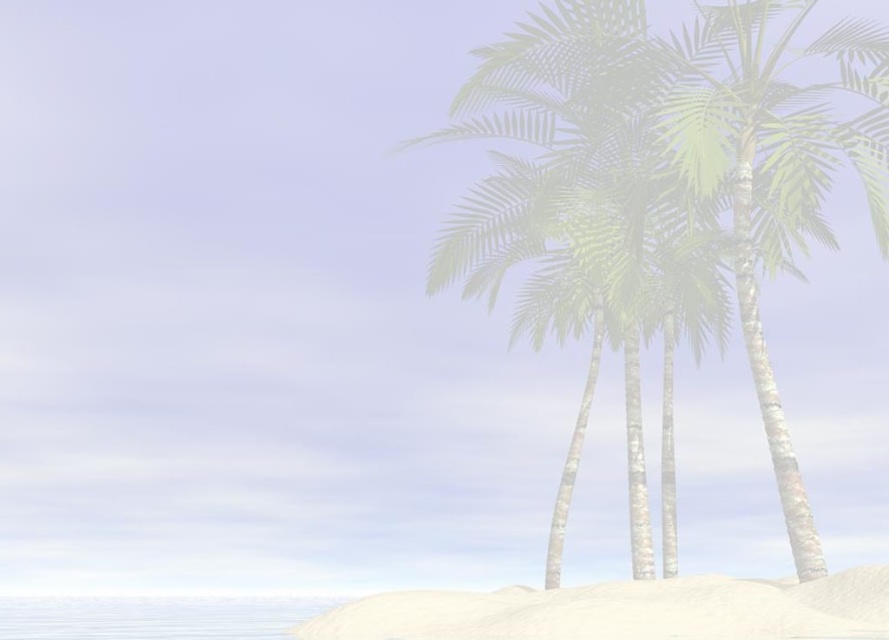
Between green leafy palm tree at right and white sandy beach at lower center, which one has less height?

With less height is green leafy palm tree at right.

Does green leafy palm tree at right appear under white sandy beach at lower center?

Incorrect, green leafy palm tree at right is not positioned below white sandy beach at lower center.

Find the location of `green leafy palm tree at right`. green leafy palm tree at right is located at coordinates (775, 170).